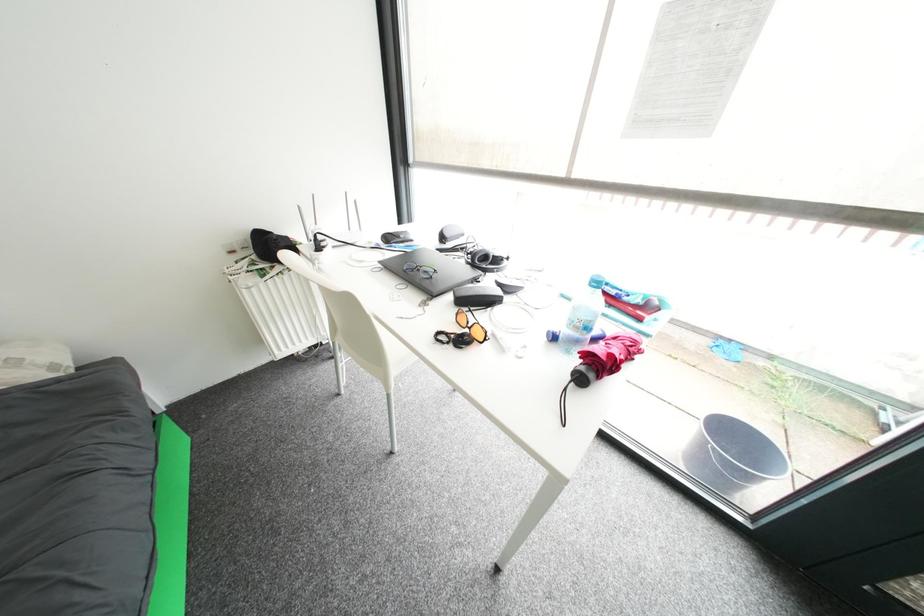
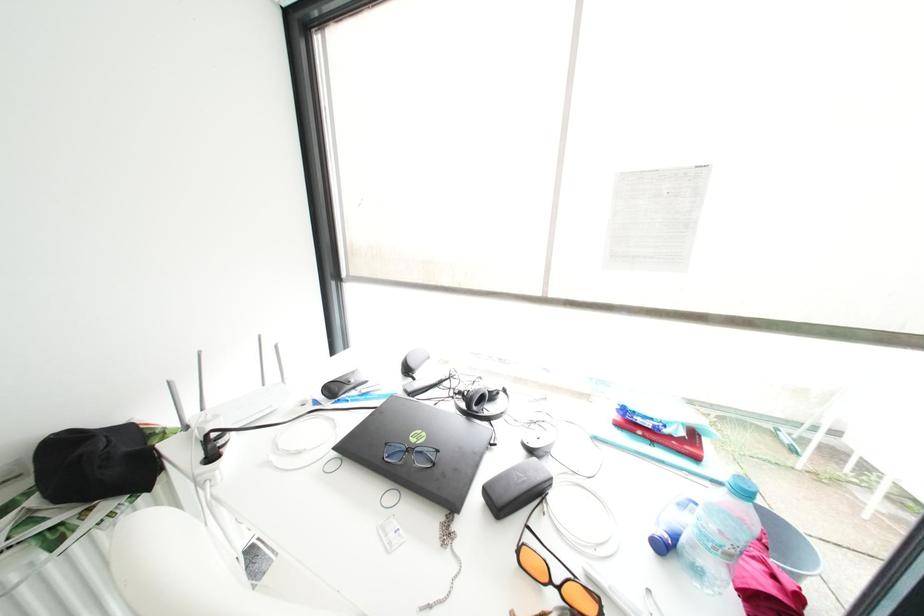
What movement of the cameraman would produce the second image?

The cameraman moved toward left, forward.